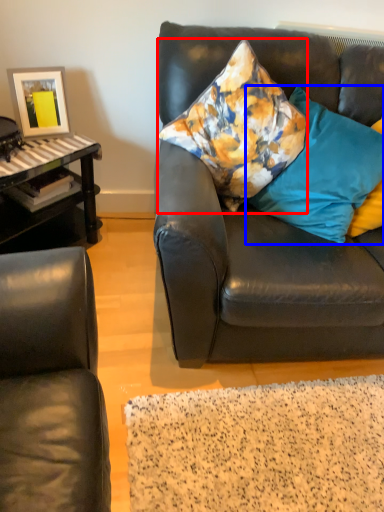
Question: Which point is closer to the camera, pillow (highlighted by a red box) or pillow (highlighted by a blue box)?

Choices:
 (A) pillow
 (B) pillow

Answer: (A)